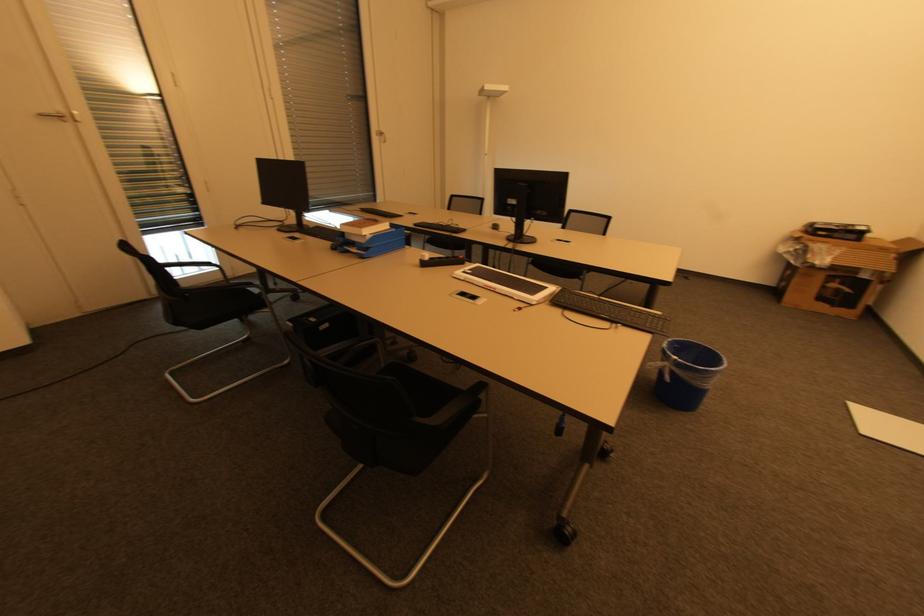
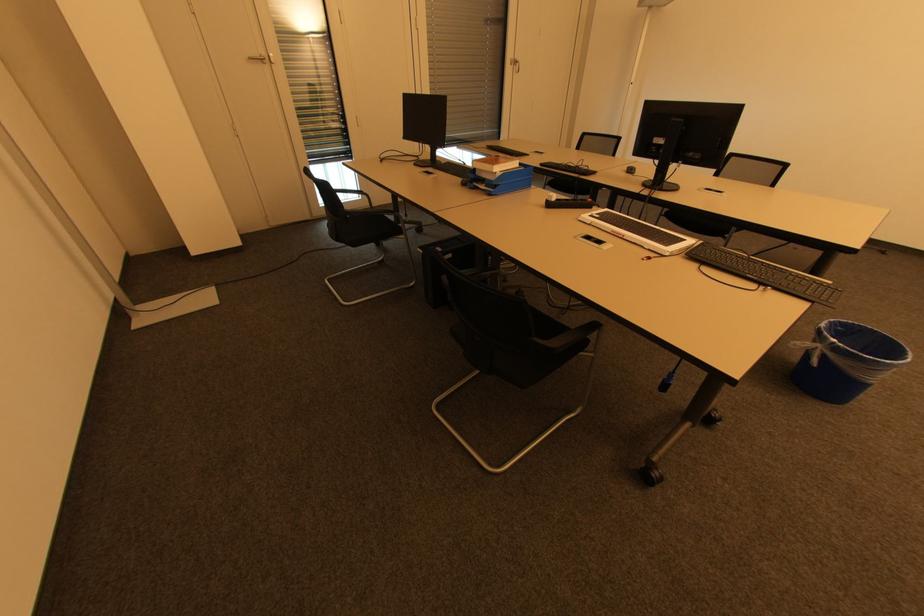
Find the pixel in the second image that matches the point at 482,387 in the first image.

(598, 326)